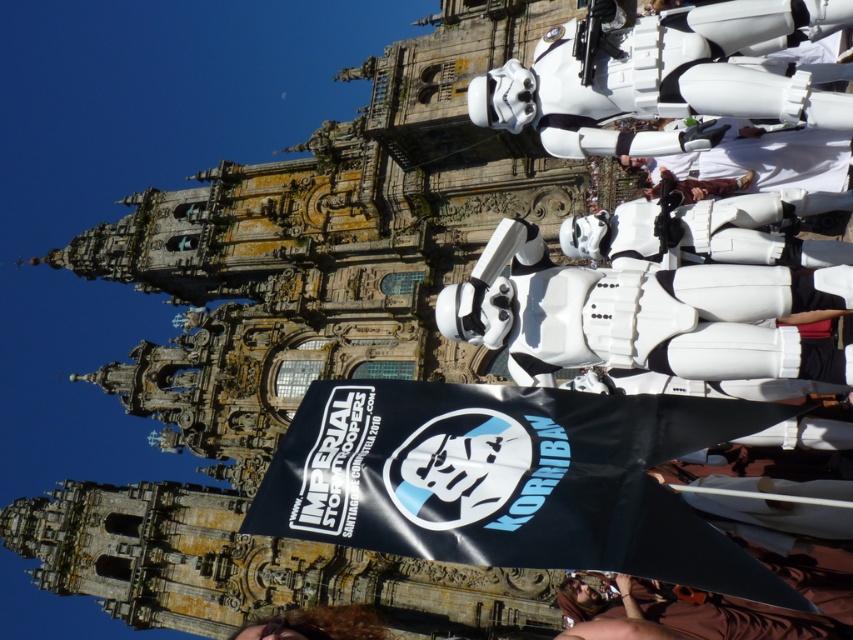
Consider the image. Does black fabric flag at center appear on the right side of curly brown hair at lower center?

Correct, you'll find black fabric flag at center to the right of curly brown hair at lower center.

Who is higher up, black fabric flag at center or curly brown hair at lower center?

black fabric flag at center

Who is more distant from viewer, (618, 492) or (332, 634)?

Point (332, 634)

The image size is (853, 640). Find the location of `black fabric flag at center`. black fabric flag at center is located at coordinates (509, 480).

Between point (720, 301) and point (473, 410), which one is positioned behind?

The point (473, 410) is behind.

Can you confirm if white matte stormtrooper at center is shorter than black fabric flag at center?

Incorrect, white matte stormtrooper at center's height does not fall short of black fabric flag at center's.

Which is in front, point (734, 284) or point (573, 499)?

Positioned in front is point (573, 499).

You are a GUI agent. You are given a task and a screenshot of the screen. Output one action in this format:
    pyautogui.click(x=<x>, y=<y>)
    Task: Click on the white matte stormtrooper at center
    This screenshot has width=853, height=640.
    Given the screenshot: What is the action you would take?
    pyautogui.click(x=666, y=298)

Is white matte stormtrooper at center in front of curly brown hair at lower center?

Yes, it is in front of curly brown hair at lower center.

Who is positioned more to the left, white matte stormtrooper at center or curly brown hair at lower center?

curly brown hair at lower center is more to the left.

Where is `white matte stormtrooper at center`? The image size is (853, 640). white matte stormtrooper at center is located at coordinates (666, 298).